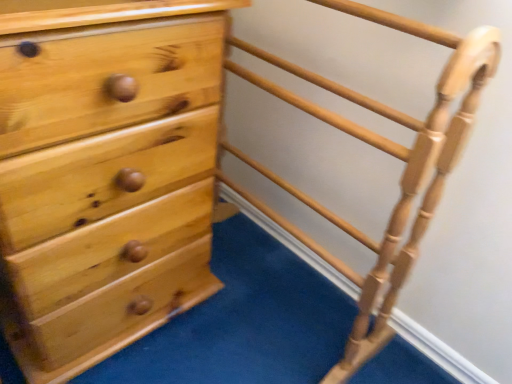
What is the approximate height of natural wood chair at upper right?

natural wood chair at upper right is 30.64 inches tall.

Find the location of a particular element. This screenshot has width=512, height=384. natural wood chair at upper right is located at coordinates (380, 150).

The width and height of the screenshot is (512, 384). Describe the element at coordinates (380, 150) in the screenshot. I see `natural wood chair at upper right` at that location.

You are a GUI agent. You are given a task and a screenshot of the screen. Output one action in this format:
    pyautogui.click(x=<x>, y=<y>)
    Task: Click on the natural wood chair at upper right
    The height and width of the screenshot is (384, 512).
    Given the screenshot: What is the action you would take?
    pyautogui.click(x=380, y=150)